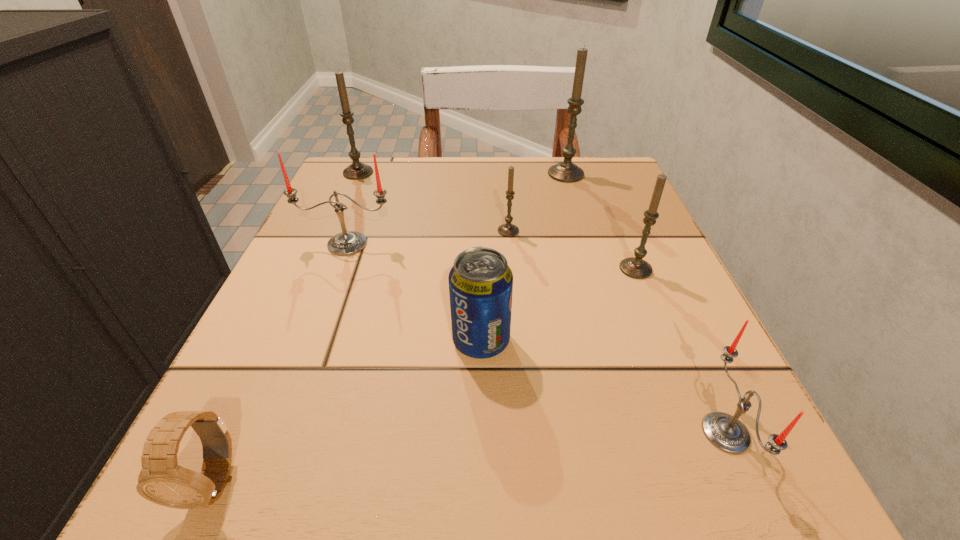
The height and width of the screenshot is (540, 960). I want to click on free space located on the front-facing side of the nearer red candle, so click(x=543, y=433).

At what (x,y) coordinates should I click in order to perform the action: click on vacant space located 0.180m on the front-facing side of the nearer red candle. Please return your answer as a coordinate pair (x, y). Looking at the image, I should click on (552, 433).

At what (x,y) coordinates should I click in order to perform the action: click on free spot located 0.280m on the front-facing side of the nearer red candle. Please return your answer as a coordinate pair (x, y). The height and width of the screenshot is (540, 960). Looking at the image, I should click on (468, 433).

Where is `candle that is at the near edge`? This screenshot has height=540, width=960. candle that is at the near edge is located at coordinates (724, 431).

Where is `watch present at the near edge`? The image size is (960, 540). watch present at the near edge is located at coordinates (161, 480).

You are a GUI agent. You are given a task and a screenshot of the screen. Output one action in this format:
    pyautogui.click(x=<x>, y=<y>)
    Task: Click on the watch that is at the left edge
    
    Given the screenshot: What is the action you would take?
    pyautogui.click(x=161, y=480)

Identify the location of object positioned at the far left corner. (357, 170).

This screenshot has width=960, height=540. Find the location of `object that is at the near left corner`. object that is at the near left corner is located at coordinates (161, 480).

At what (x,y) coordinates should I click in order to perform the action: click on object at the far right corner. Please return your answer as a coordinate pair (x, y). Looking at the image, I should click on 566,171.

This screenshot has width=960, height=540. I want to click on object at the near right corner, so click(x=724, y=431).